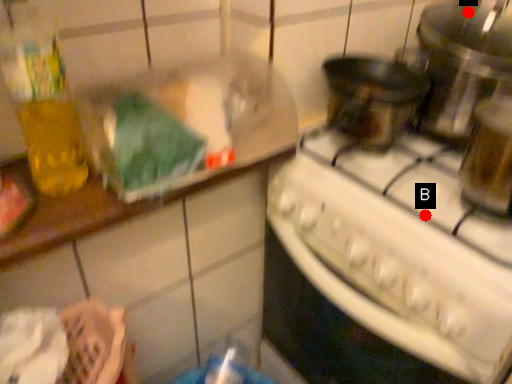
Question: Two points are circled on the image, labeled by A and B beside each circle. Which point appears closest to the camera in this image?

Choices:
 (A) A is closer
 (B) B is closer

Answer: (B)